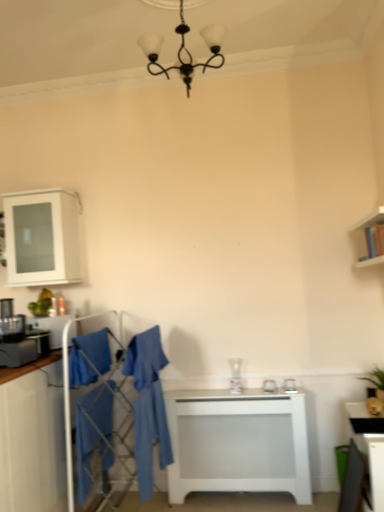
Question: From the image's perspective, is white matte table at center, the second table positioned from the right, above or below blue fabric robe at center, which is counted as the second robe, starting from the right?

Choices:
 (A) below
 (B) above

Answer: (A)

Question: From a real-world perspective, relative to blue fabric robe at center, which is counted as the second robe, starting from the right, is white matte table at center, placed as the 1th table when sorted from left to right, vertically above or below?

Choices:
 (A) above
 (B) below

Answer: (B)

Question: Considering the real-world distances, which object is closest to the blue fabric robe at center, positioned as the third robe in left-to-right order?

Choices:
 (A) white glossy vase at center, the 1th appliance viewed from the right
 (B) blue cotton robe at lower left, the third robe from the right
 (C) white matte table at center, the second table positioned from the right
 (D) white glossy cabinet at upper left, the 2th cabinetry when ordered from bottom to top
 (E) matte black chair at lower right

Answer: (B)

Question: Estimate the real-world distances between objects in this image. Which object is farther from the blue fabric robe at center, which is counted as the second robe, starting from the right?

Choices:
 (A) white glossy cabinet at upper left, which is the 1th cabinetry in top-to-bottom order
 (B) blue fabric swivel chair at center
 (C) black glass chandelier at upper center
 (D) blue cotton robe at center, arranged as the 1th robe when viewed from the right
 (E) matte white cabinet at left, the 2th cabinetry positioned from the top

Answer: (C)